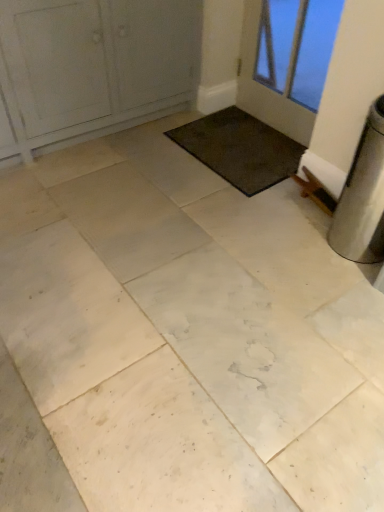
Measure the distance between dark brown carpet at center and camera.

A distance of 7.37 feet exists between dark brown carpet at center and camera.

Identify the location of white painted wood door at upper left, the first door positioned from the left. The image size is (384, 512). (92, 69).

What do you see at coordinates (92, 69) in the screenshot?
I see `white painted wood door at upper left, the first door positioned from the left` at bounding box center [92, 69].

Where is `white glass door at upper right, the first door from the right`? This screenshot has height=512, width=384. white glass door at upper right, the first door from the right is located at coordinates (285, 64).

At what (x,y) coordinates should I click in order to perform the action: click on dark brown carpet at center. Please return your answer as a coordinate pair (x, y). Looking at the image, I should click on (240, 149).

Which object is thinner, white painted wood door at upper left, the first door positioned from the left, or dark brown carpet at center?

With smaller width is dark brown carpet at center.

Is white painted wood door at upper left, acting as the 2th door starting from the right, shorter than dark brown carpet at center?

No.

Based on the photo, can you tell me how much white painted wood door at upper left, the first door positioned from the left, and dark brown carpet at center differ in facing direction?

The angle between the facing direction of white painted wood door at upper left, the first door positioned from the left, and the facing direction of dark brown carpet at center is 88.5 degrees.

Is white painted wood door at upper left, the first door positioned from the left, facing away from dark brown carpet at center?

No, white painted wood door at upper left, the first door positioned from the left, is not facing the opposite direction of dark brown carpet at center.

From a real-world perspective, is white painted wood door at upper left, acting as the 2th door starting from the right, on white glass door at upper right, which is the 2th door in left-to-right order?

Correct, in the physical world, white painted wood door at upper left, acting as the 2th door starting from the right, is higher than white glass door at upper right, which is the 2th door in left-to-right order.

Based on the photo, is white painted wood door at upper left, the first door positioned from the left, shorter than white glass door at upper right, the first door from the right?

Incorrect, the height of white painted wood door at upper left, the first door positioned from the left, does not fall short of that of white glass door at upper right, the first door from the right.

Is white glass door at upper right, which is the 2th door in left-to-right order, at the back of white painted wood door at upper left, acting as the 2th door starting from the right?

That's not correct — white painted wood door at upper left, acting as the 2th door starting from the right, is not looking away from white glass door at upper right, which is the 2th door in left-to-right order.

How much distance is there between white glass door at upper right, the first door from the right, and dark brown carpet at center?

white glass door at upper right, the first door from the right, and dark brown carpet at center are 85.99 centimeters apart from each other.

From a real-world perspective, does white glass door at upper right, the first door from the right, sit lower than dark brown carpet at center?

No, from a real-world perspective, white glass door at upper right, the first door from the right, is not under dark brown carpet at center.

Is the position of white glass door at upper right, which is the 2th door in left-to-right order, more distant than that of dark brown carpet at center?

No, white glass door at upper right, which is the 2th door in left-to-right order, is closer to the viewer.

Which of these two, white glass door at upper right, the first door from the right, or dark brown carpet at center, is thinner?

white glass door at upper right, the first door from the right.

Consider the image. Between dark brown carpet at center and white painted wood door at upper left, the first door positioned from the left, which one is positioned in front?

white painted wood door at upper left, the first door positioned from the left, is in front.

Can you confirm if dark brown carpet at center is thinner than white painted wood door at upper left, the first door positioned from the left?

Yes, dark brown carpet at center is thinner than white painted wood door at upper left, the first door positioned from the left.

Is dark brown carpet at center far away from white painted wood door at upper left, the first door positioned from the left?

No, there isn't a large distance between dark brown carpet at center and white painted wood door at upper left, the first door positioned from the left.

Is dark brown carpet at center positioned beyond the bounds of white painted wood door at upper left, acting as the 2th door starting from the right?

Absolutely, dark brown carpet at center is external to white painted wood door at upper left, acting as the 2th door starting from the right.

Considering the relative sizes of dark brown carpet at center and white glass door at upper right, which is the 2th door in left-to-right order, in the image provided, is dark brown carpet at center wider than white glass door at upper right, which is the 2th door in left-to-right order,?

Yes.

Based on the photo, from the image's perspective, which one is positioned lower, dark brown carpet at center or white glass door at upper right, the first door from the right?

dark brown carpet at center appears lower in the image.

Between white glass door at upper right, which is the 2th door in left-to-right order, and white painted wood door at upper left, the first door positioned from the left, which one is positioned behind?

Positioned behind is white glass door at upper right, which is the 2th door in left-to-right order.

Can you see white glass door at upper right, the first door from the right, touching white painted wood door at upper left, the first door positioned from the left?

No, white glass door at upper right, the first door from the right, is not making contact with white painted wood door at upper left, the first door positioned from the left.

Considering the sizes of objects white glass door at upper right, which is the 2th door in left-to-right order, and white painted wood door at upper left, acting as the 2th door starting from the right, in the image provided, who is bigger, white glass door at upper right, which is the 2th door in left-to-right order, or white painted wood door at upper left, acting as the 2th door starting from the right,?

Bigger between the two is white painted wood door at upper left, acting as the 2th door starting from the right.

Based on the photo, is white glass door at upper right, which is the 2th door in left-to-right order, positioned beyond the bounds of white painted wood door at upper left, acting as the 2th door starting from the right?

That's correct, white glass door at upper right, which is the 2th door in left-to-right order, is outside of white painted wood door at upper left, acting as the 2th door starting from the right.

Image resolution: width=384 pixels, height=512 pixels. In the image, there is a white painted wood door at upper left, the first door positioned from the left. In order to click on mat below it (from the image's perspective) in this screenshot , I will do `click(240, 149)`.

At what (x,y) coordinates should I click in order to perform the action: click on door to the right of white painted wood door at upper left, the first door positioned from the left. Please return your answer as a coordinate pair (x, y). Looking at the image, I should click on (285, 64).

Based on their spatial positions, is white painted wood door at upper left, acting as the 2th door starting from the right, or white glass door at upper right, which is the 2th door in left-to-right order, closer to dark brown carpet at center?

Among the two, white painted wood door at upper left, acting as the 2th door starting from the right, is located nearer to dark brown carpet at center.

Considering their positions, is white glass door at upper right, which is the 2th door in left-to-right order, positioned closer to white painted wood door at upper left, the first door positioned from the left, than dark brown carpet at center?

The object closer to white painted wood door at upper left, the first door positioned from the left, is dark brown carpet at center.

Looking at the image, which one is located further to white glass door at upper right, which is the 2th door in left-to-right order, dark brown carpet at center or white painted wood door at upper left, the first door positioned from the left?

white painted wood door at upper left, the first door positioned from the left, is further to white glass door at upper right, which is the 2th door in left-to-right order.

Based on their spatial positions, is white painted wood door at upper left, acting as the 2th door starting from the right, or dark brown carpet at center further from white glass door at upper right, which is the 2th door in left-to-right order?

white painted wood door at upper left, acting as the 2th door starting from the right, lies further to white glass door at upper right, which is the 2th door in left-to-right order, than the other object.

Based on their spatial positions, is white glass door at upper right, which is the 2th door in left-to-right order, or white painted wood door at upper left, the first door positioned from the left, closer to dark brown carpet at center?

The object closer to dark brown carpet at center is white painted wood door at upper left, the first door positioned from the left.

From the image, which object appears to be nearer to white painted wood door at upper left, the first door positioned from the left, dark brown carpet at center or white glass door at upper right, the first door from the right?

Among the two, dark brown carpet at center is located nearer to white painted wood door at upper left, the first door positioned from the left.

Locate an element on the screen. The image size is (384, 512). mat between white painted wood door at upper left, acting as the 2th door starting from the right, and white glass door at upper right, which is the 2th door in left-to-right order is located at coordinates (240, 149).